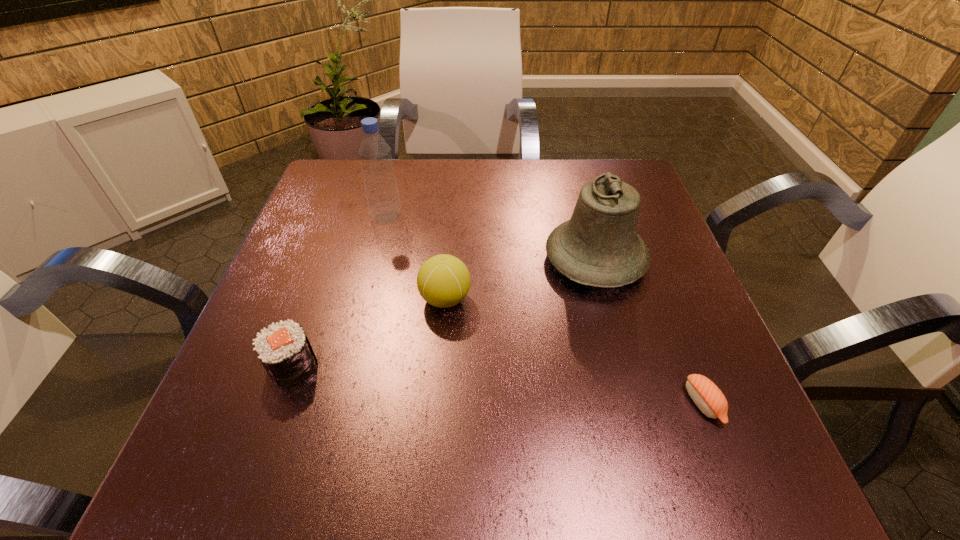
In order to click on free space located on the front of the second tallest object in this screenshot , I will do `click(614, 329)`.

Find the location of a particular element. This screenshot has height=540, width=960. free space located on the right of the tennis ball is located at coordinates (634, 299).

I want to click on vacant space situated 0.100m on the right of the second shortest object, so pyautogui.click(x=377, y=366).

Find the location of a particular element. free spot located 0.310m on the back of the shortest object is located at coordinates (644, 253).

In order to click on object positioned at the far edge in this screenshot , I will do `click(380, 184)`.

Identify the location of bottle that is at the left edge. pyautogui.click(x=380, y=184).

Locate an element on the screen. Image resolution: width=960 pixels, height=540 pixels. sushi situated at the left edge is located at coordinates (284, 350).

The width and height of the screenshot is (960, 540). In order to click on bell that is at the right edge in this screenshot , I will do `click(599, 246)`.

What are the coordinates of `sushi that is at the right edge` in the screenshot? It's located at (706, 395).

I want to click on object that is positioned at the far left corner, so click(x=380, y=184).